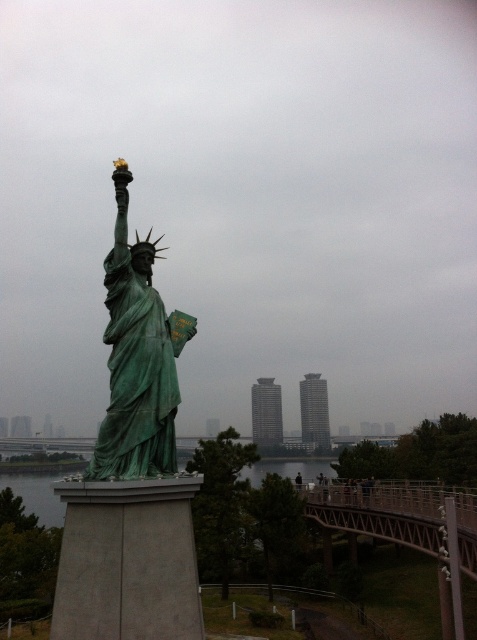
Question: Is green patina statue at center positioned behind green patina water at lower left?

Choices:
 (A) no
 (B) yes

Answer: (A)

Question: Does green patina statue at center appear on the right side of green patina water at lower left?

Choices:
 (A) no
 (B) yes

Answer: (B)

Question: Is green patina statue at center above green patina water at lower left?

Choices:
 (A) no
 (B) yes

Answer: (B)

Question: Which of the following is the closest to the observer?

Choices:
 (A) (333, 476)
 (B) (146, 298)

Answer: (B)

Question: Which point appears closest to the camera in this image?

Choices:
 (A) (x=250, y=481)
 (B) (x=121, y=157)

Answer: (B)

Question: Which of the following is the closest to the observer?

Choices:
 (A) (124, 227)
 (B) (53, 506)

Answer: (A)